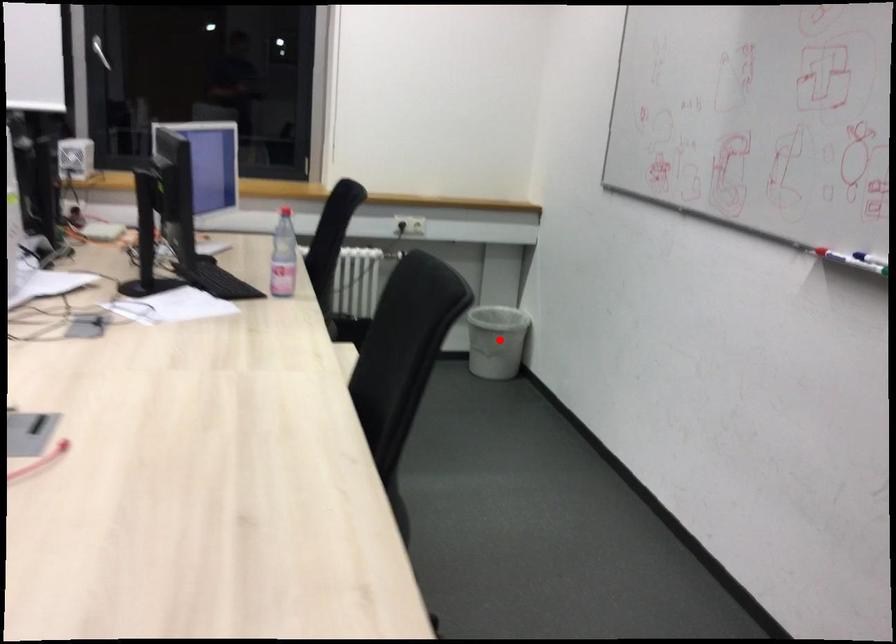
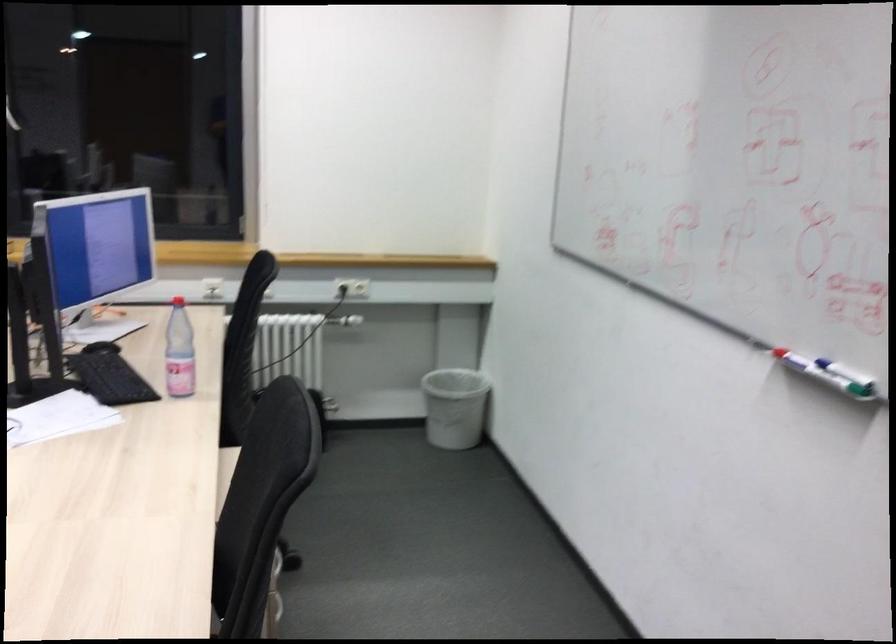
Find the pixel in the second image that matches the highlighted location in the first image.

(454, 406)